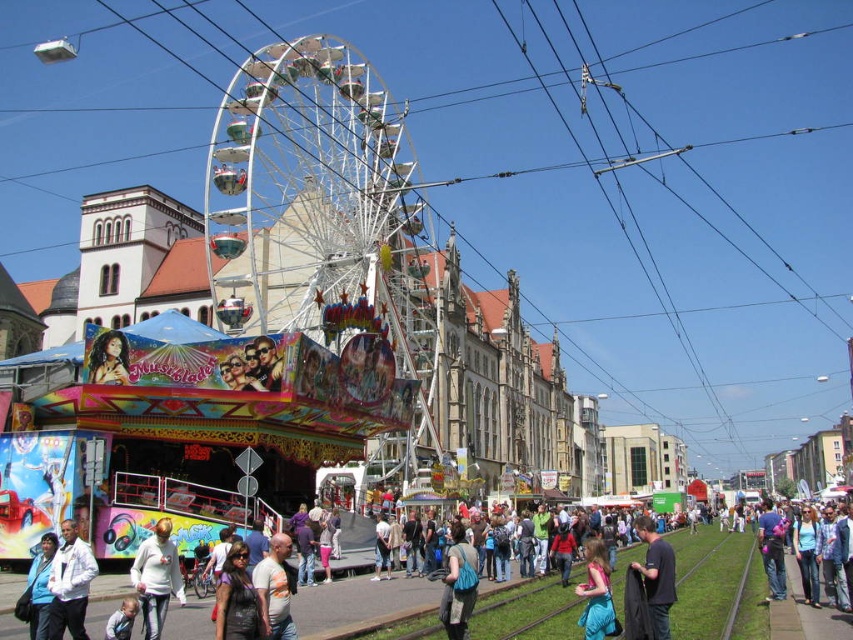
Between point (265, 627) and point (590, 621), which one is positioned behind?

Point (590, 621)

Is light blue shirt at lower center to the left of blue satin dress at lower center from the viewer's perspective?

Correct, you'll find light blue shirt at lower center to the left of blue satin dress at lower center.

This screenshot has height=640, width=853. Find the location of `light blue shirt at lower center`. light blue shirt at lower center is located at coordinates point(276,588).

Who is lower down, white matte jacket at lower left or blue fabric bag at center?

blue fabric bag at center is below.

Who is taller, white matte jacket at lower left or blue fabric bag at center?

Standing taller between the two is blue fabric bag at center.

Is point (73, 634) behind point (450, 570)?

No, it is in front of (450, 570).

Locate an element on the screen. This screenshot has height=640, width=853. white matte jacket at lower left is located at coordinates (70, 582).

Does dark blue jeans at lower right appear over blue satin dress at lower center?

Indeed, dark blue jeans at lower right is positioned over blue satin dress at lower center.

Is dark blue jeans at lower right smaller than blue satin dress at lower center?

Yes.

Find the location of a particular element. This screenshot has height=640, width=853. dark blue jeans at lower right is located at coordinates (656, 576).

Locate an element on the screen. This screenshot has width=853, height=640. dark blue jeans at lower right is located at coordinates (656, 576).